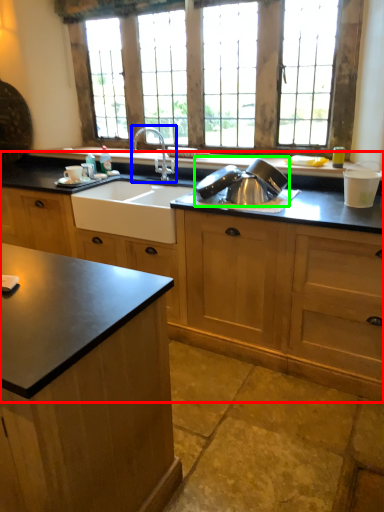
Question: Considering the real-world distances, which object is closest to cabinetry (highlighted by a red box)? tap (highlighted by a blue box) or appliance (highlighted by a green box).

Choices:
 (A) tap
 (B) appliance

Answer: (B)